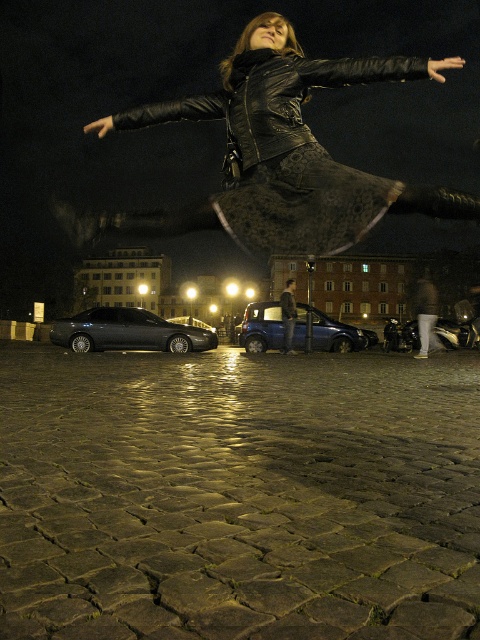
Is dark stone paving at center further to camera compared to shiny black sedan at center-left?

No, it is in front of shiny black sedan at center-left.

Does point (302, 602) lie behind point (60, 321)?

No, (302, 602) is closer to viewer.

Describe the element at coordinates (238, 497) in the screenshot. I see `dark stone paving at center` at that location.

I want to click on dark stone paving at center, so click(x=238, y=497).

Is the position of black leather jacket at center less distant than that of blue metallic car at center?

Yes, black leather jacket at center is closer to the viewer.

Can you confirm if black leather jacket at center is taller than blue metallic car at center?

Yes, black leather jacket at center is taller than blue metallic car at center.

Between point (264, 102) and point (361, 333), which one is positioned in front?

Point (264, 102)

I want to click on black leather jacket at center, so click(x=277, y=156).

Does dark stone paving at center appear on the right side of black leather jacket at center?

In fact, dark stone paving at center is to the left of black leather jacket at center.

Does point (116, 540) come farther from viewer compared to point (321, 198)?

No, it is in front of (321, 198).

Which is in front, point (380, 576) or point (339, 177)?

Point (380, 576) is more forward.

Identify the location of dark stone paving at center. (238, 497).